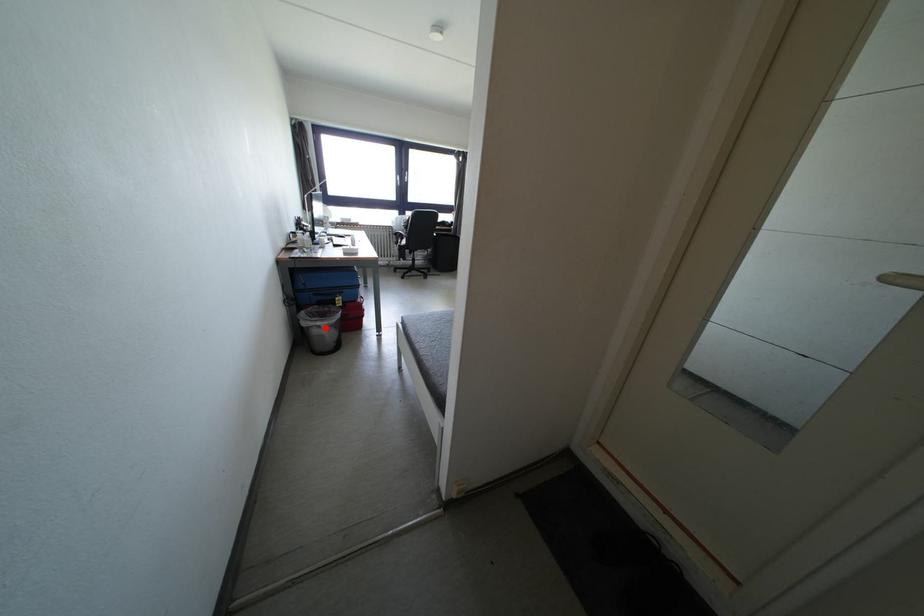
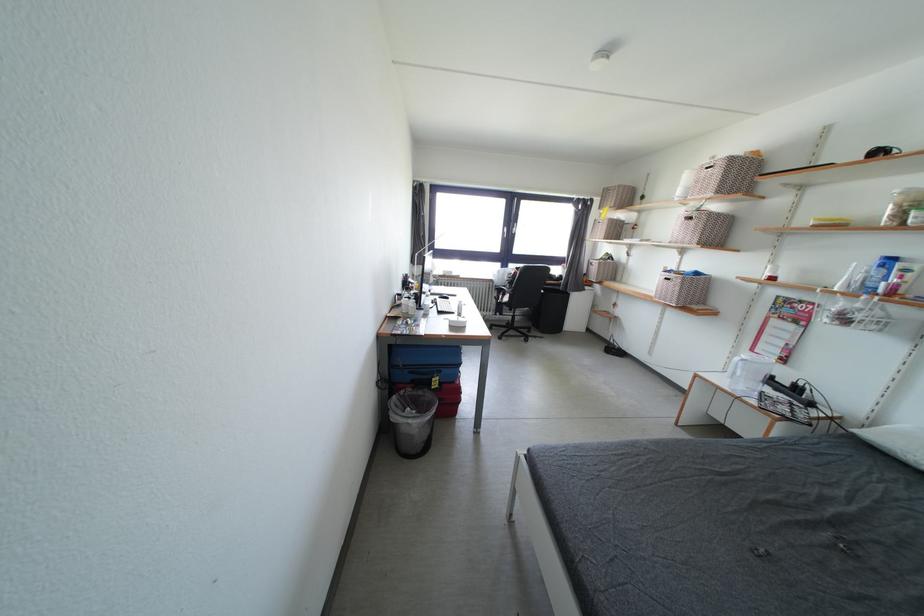
Find the pixel in the second image that matches the highlighted location in the first image.

(417, 426)